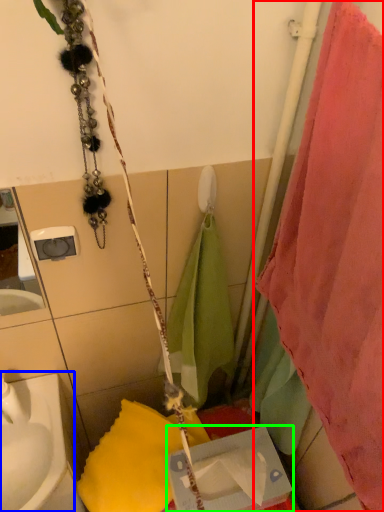
Question: Which object is positioned closest to curtain (highlighted by a red box)? Select from sink (highlighted by a blue box) and box (highlighted by a green box).

Choices:
 (A) sink
 (B) box

Answer: (B)